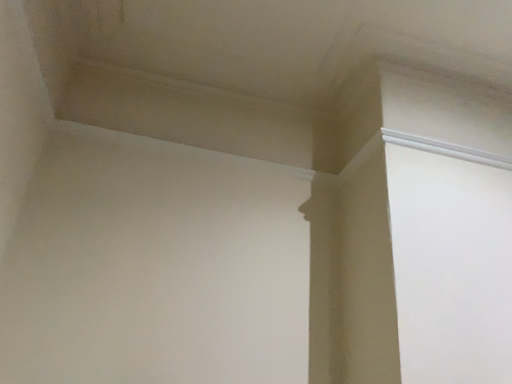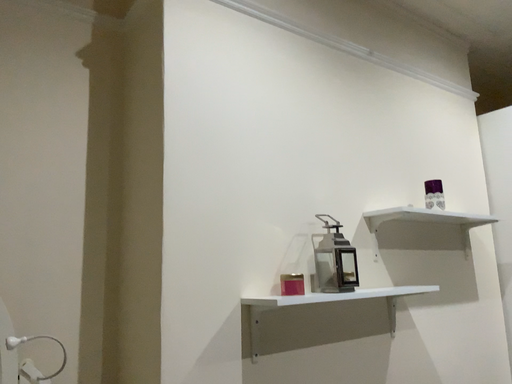
Question: Which way did the camera rotate in the video?

Choices:
 (A) rotated upward
 (B) rotated downward

Answer: (B)